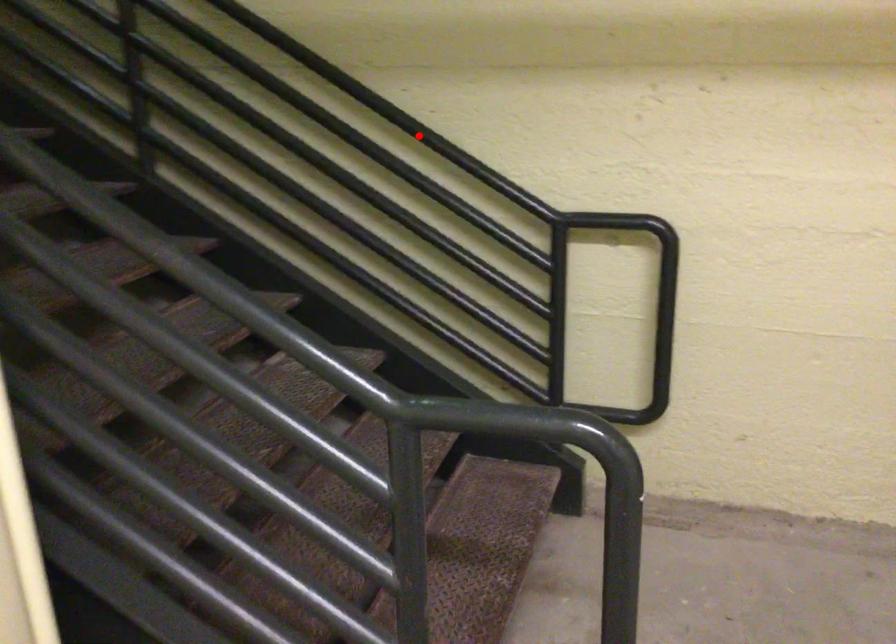
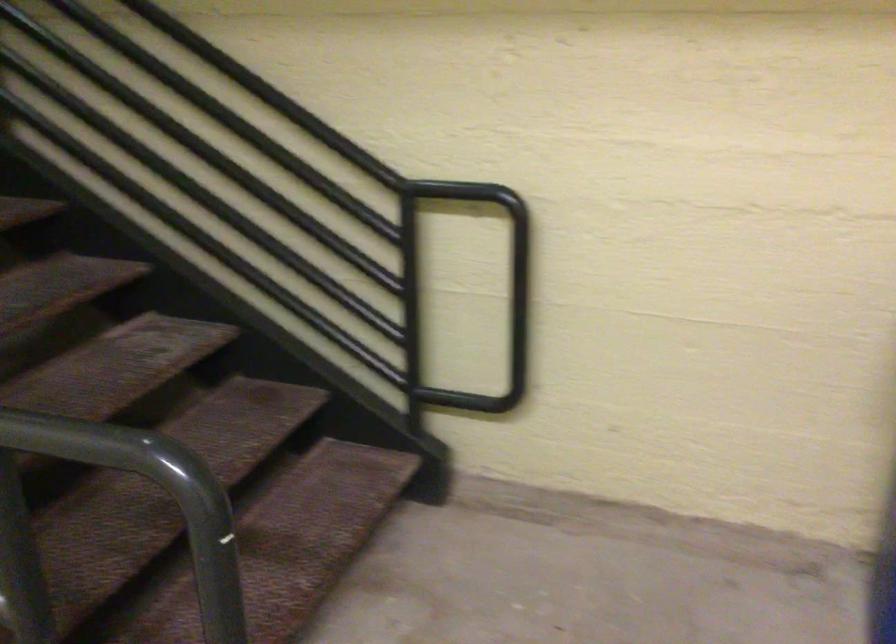
Question: I am providing you with two images of the same scene from different viewpoints. A red point is marked on the first image. Is the red point's position out of view in image 2?

Choices:
 (A) Yes
 (B) No

Answer: (B)